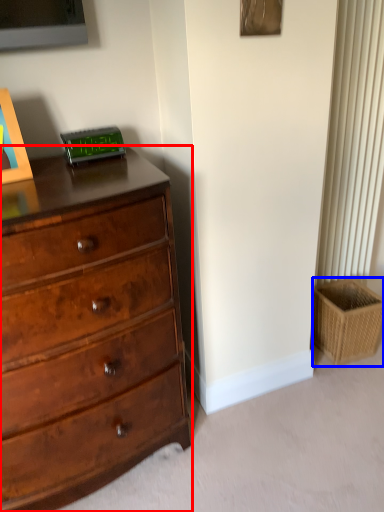
Question: Which object appears farthest to the camera in this image, chest of drawers (highlighted by a red box) or basket (highlighted by a blue box)?

Choices:
 (A) chest of drawers
 (B) basket

Answer: (B)